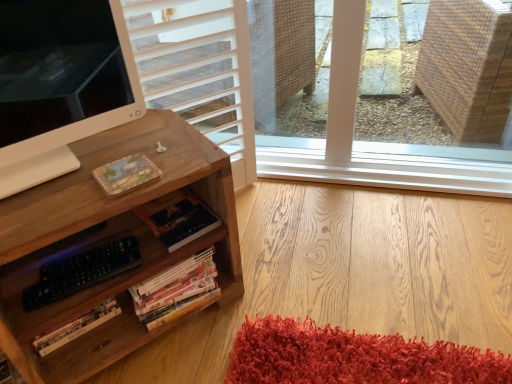
Image resolution: width=512 pixels, height=384 pixels. What are the coordinates of `empty space that is ontop of wooden desk at left (from a real-world perspective)` in the screenshot? It's located at (91, 158).